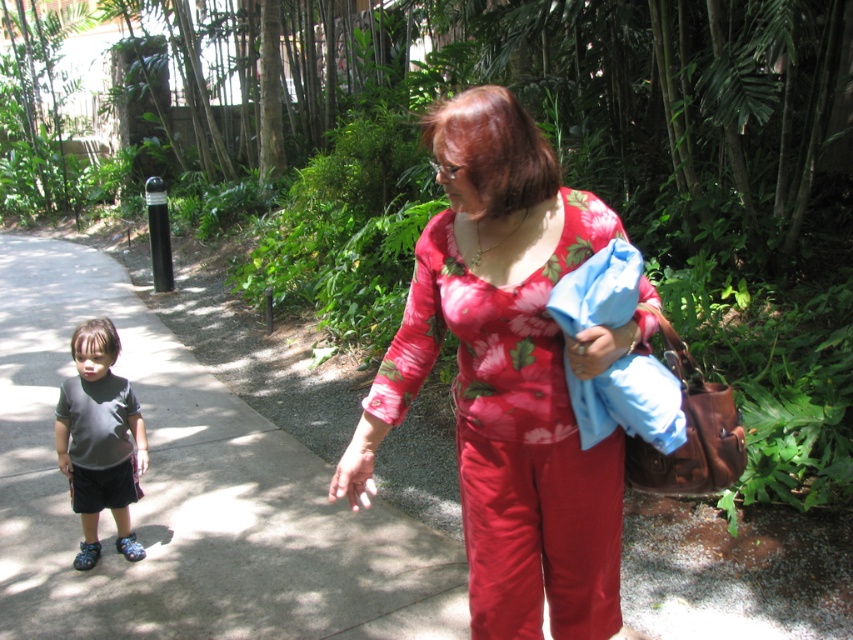
Does gray concrete pavement at lower left have a greater height compared to dark gray matte shirt at left?

Indeed, gray concrete pavement at lower left has a greater height compared to dark gray matte shirt at left.

Is the position of gray concrete pavement at lower left more distant than that of dark gray matte shirt at left?

No, gray concrete pavement at lower left is in front of dark gray matte shirt at left.

Where is `gray concrete pavement at lower left`? gray concrete pavement at lower left is located at coordinates (187, 493).

Does floral cotton blouse at center appear over dark gray matte shirt at left?

Indeed, floral cotton blouse at center is positioned over dark gray matte shirt at left.

Can you confirm if floral cotton blouse at center is thinner than dark gray matte shirt at left?

Incorrect, floral cotton blouse at center's width is not less than dark gray matte shirt at left's.

Describe the element at coordinates (509, 376) in the screenshot. I see `floral cotton blouse at center` at that location.

Identify the location of floral cotton blouse at center. The width and height of the screenshot is (853, 640). (509, 376).

Does point (28, 356) come behind point (610, 344)?

That is True.

Which is more to the left, gray concrete pavement at lower left or floral cotton blouse at center?

From the viewer's perspective, gray concrete pavement at lower left appears more on the left side.

The height and width of the screenshot is (640, 853). In order to click on gray concrete pavement at lower left in this screenshot , I will do `click(187, 493)`.